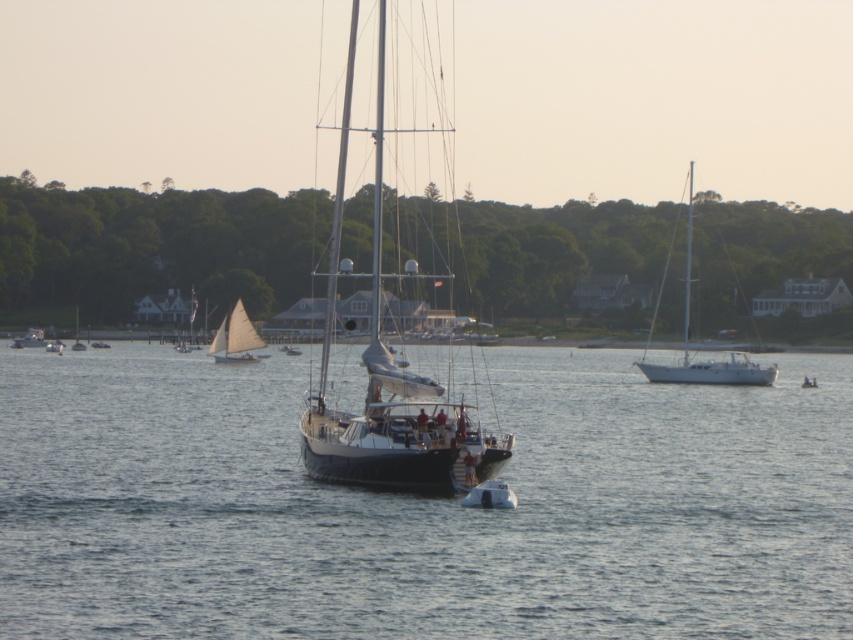
You are a photographer trying to capture the black matte sailboat at center and the shiny white sailboat at center in a single shot. Based on their positions, which one would appear closer to the camera in the photo?

The black matte sailboat at center appears closer to the camera because it is positioned in front of the shiny white sailboat at center.

You are standing on a dock and see the white glossy sailboat at right. If you want to throw a lifebuoy to someone on the boat, would the distance be too far for a typical throw?

The white glossy sailboat at right is 287.11 feet away from viewer. A typical throw range for a lifebuoy is around 30 to 50 feet, so the distance is too far to reach with a throw.